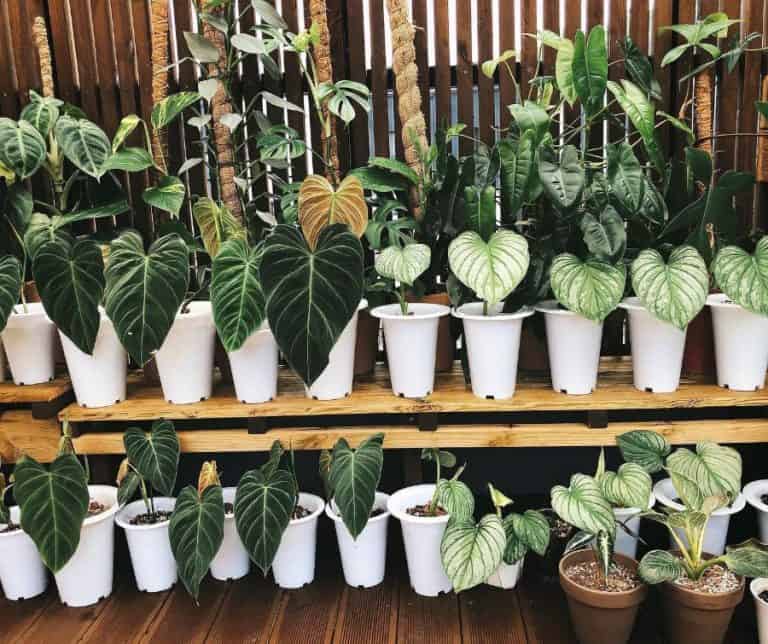
You are a GUI agent. You are given a task and a screenshot of the screen. Output one action in this format:
    pyautogui.click(x=<x>, y=<y>)
    Task: Click on the pot
    This screenshot has width=768, height=644.
    Given the screenshot: What is the action you would take?
    pyautogui.click(x=333, y=371)